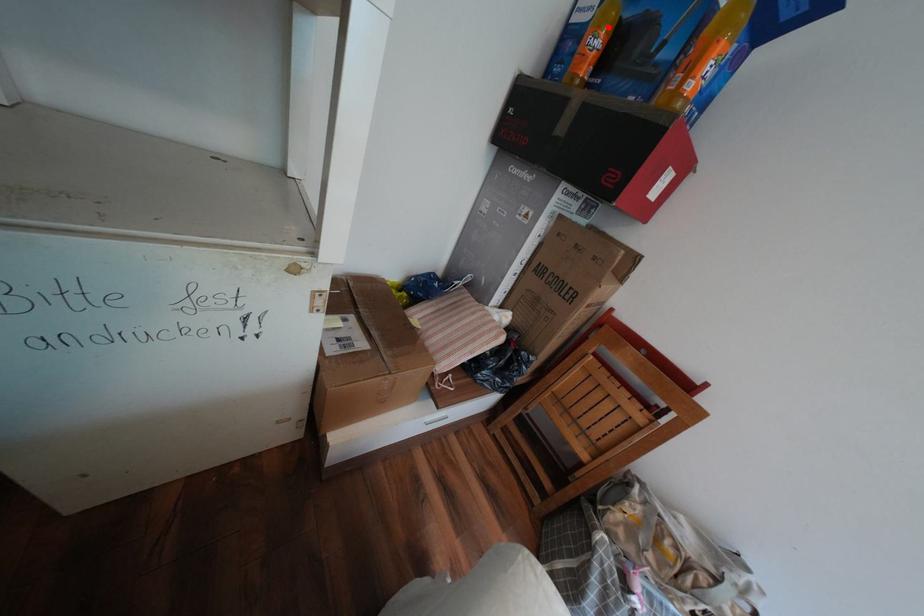
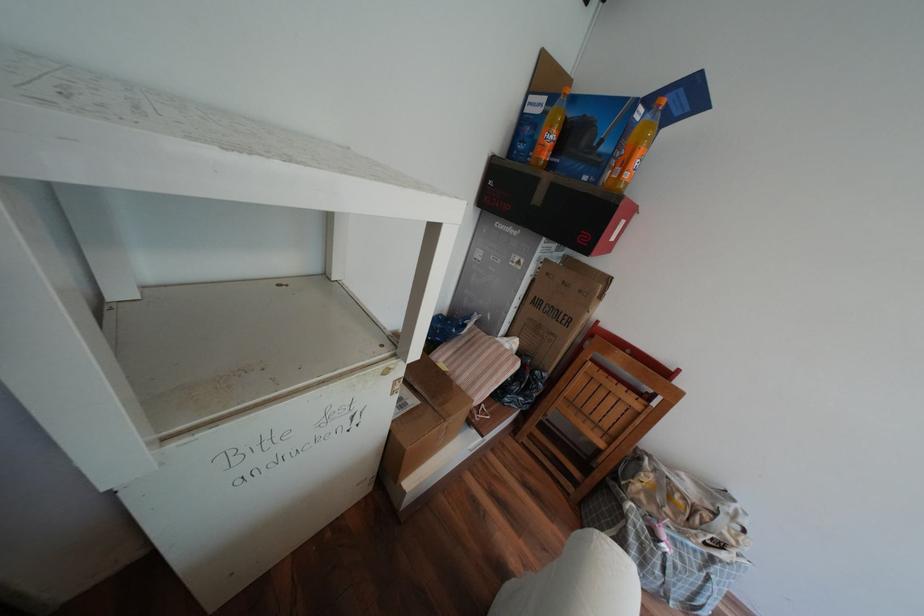
Question: I am providing you with two images of the same scene from different viewpoints. A red point is marked on the first image. Is the red point's position out of view in image 2?

Choices:
 (A) Yes
 (B) No

Answer: (B)